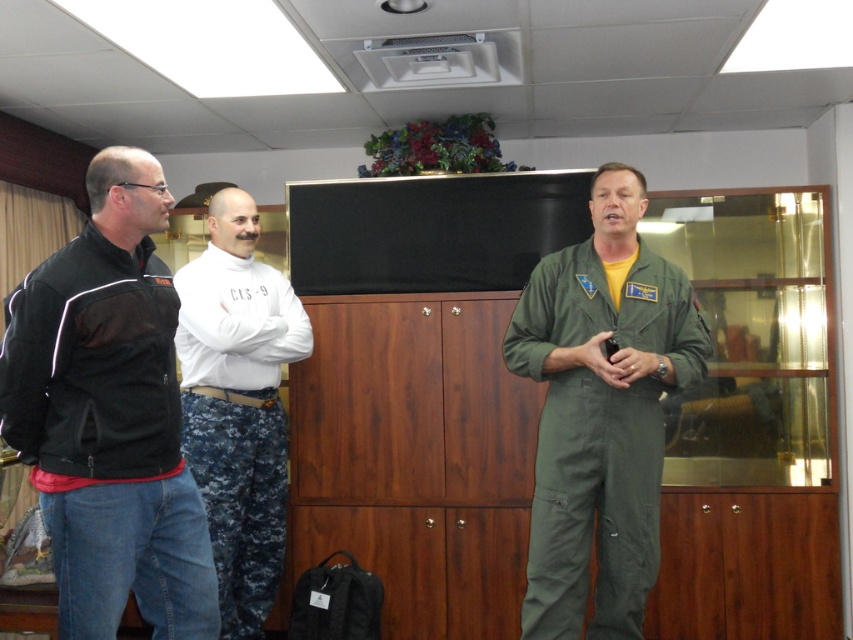
Question: Which object is the farthest from the wooden cabinet at center?

Choices:
 (A) white cotton shirt at center
 (B) green fabric jumpsuit at center

Answer: (B)

Question: Which point appears closest to the camera in this image?

Choices:
 (A) (547, 573)
 (B) (780, 401)
 (C) (233, 294)

Answer: (A)

Question: Which point appears closest to the camera in this image?

Choices:
 (A) (482, 266)
 (B) (618, 410)
 (C) (88, 228)

Answer: (C)

Question: Can you confirm if wooden cabinet at center is bigger than white cotton shirt at center?

Choices:
 (A) no
 (B) yes

Answer: (B)

Question: Can you confirm if wooden cabinet at center is positioned above green fabric jumpsuit at center?

Choices:
 (A) no
 (B) yes

Answer: (A)

Question: Is the position of wooden cabinet at center less distant than that of green fabric jumpsuit at center?

Choices:
 (A) yes
 (B) no

Answer: (B)